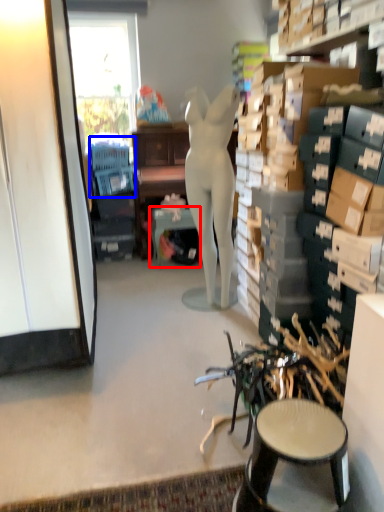
Question: Among these objects, which one is nearest to the camera, table (highlighted by a red box) or swivel chair (highlighted by a blue box)?

Choices:
 (A) table
 (B) swivel chair

Answer: (A)